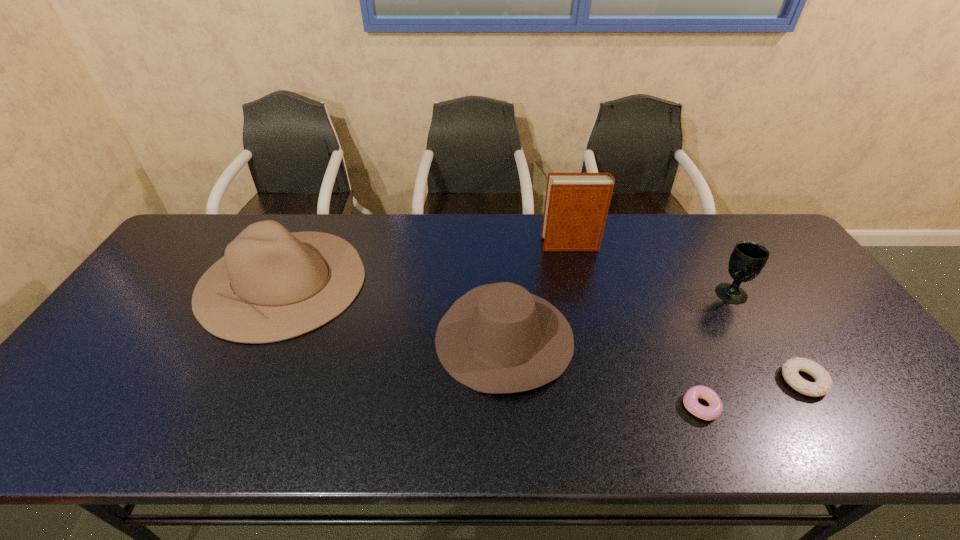
Locate an element on the screen. The image size is (960, 540). free point located 0.200m on the left of the chalice is located at coordinates (646, 293).

You are a GUI agent. You are given a task and a screenshot of the screen. Output one action in this format:
    pyautogui.click(x=<x>, y=<y>)
    Task: Click on the blank area located on the left of the third shortest object
    This screenshot has width=960, height=540.
    Given the screenshot: What is the action you would take?
    pyautogui.click(x=359, y=337)

Where is `vacant space located on the left of the right doughnut`? The image size is (960, 540). vacant space located on the left of the right doughnut is located at coordinates (706, 381).

This screenshot has width=960, height=540. Identify the location of free space located on the back of the fourth object from left to right. (672, 338).

This screenshot has width=960, height=540. Find the location of `hardback book positioned at the far edge`. hardback book positioned at the far edge is located at coordinates (576, 205).

I want to click on sombrero that is at the far edge, so pyautogui.click(x=292, y=283).

Image resolution: width=960 pixels, height=540 pixels. I want to click on object present at the near edge, so click(690, 400).

Identify the location of object present at the left edge. (292, 283).

This screenshot has width=960, height=540. Find the location of `object that is at the right edge`. object that is at the right edge is located at coordinates (823, 384).

Locate an element on the screen. Image resolution: width=960 pixels, height=540 pixels. object that is at the far left corner is located at coordinates (292, 283).